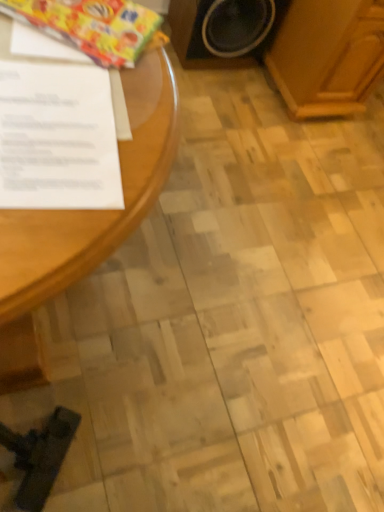
Describe the element at coordinates (91, 26) in the screenshot. This screenshot has height=512, width=384. I see `shiny plastic wrapping paper at upper left` at that location.

Measure the distance between wooden speaker at upper right and camera.

The depth of wooden speaker at upper right is 1.81 meters.

Find the location of a particular element. This screenshot has height=512, width=384. light brown wood at upper right is located at coordinates (328, 56).

In order to face white paper at left, should I rotate leftwards or rightwards?

Rotate your view left by about 21.031°.

The image size is (384, 512). What are the coordinates of `shiny plastic wrapping paper at upper left` in the screenshot? It's located at (91, 26).

Which is more to the right, shiny plastic wrapping paper at upper left or white paper at left?

From the viewer's perspective, shiny plastic wrapping paper at upper left appears more on the right side.

Does point (116, 61) come farther from viewer compared to point (61, 188)?

Yes, point (116, 61) is behind point (61, 188).

Is shiny plastic wrapping paper at upper left in front of or behind white paper at left in the image?

shiny plastic wrapping paper at upper left is behind white paper at left.

From a real-world perspective, which is physically above, shiny plastic wrapping paper at upper left or white paper at left?

white paper at left is physically above.

Identify the location of document on the left of the light brown wood at upper right. This screenshot has height=512, width=384. (57, 138).

Is light brown wood at upper right to the left of white paper at left from the viewer's perspective?

No.

Could you tell me if light brown wood at upper right is turned towards white paper at left?

No, light brown wood at upper right is not oriented towards white paper at left.

How different are the orientations of light brown wood at upper right and white paper at left in degrees?

The angular difference between light brown wood at upper right and white paper at left is 88 degrees.

Is shiny plastic wrapping paper at upper left taller than light brown wood at upper right?

Incorrect, the height of shiny plastic wrapping paper at upper left is not larger of that of light brown wood at upper right.

From the image's perspective, is shiny plastic wrapping paper at upper left located beneath light brown wood at upper right?

Yes, from the image's perspective, shiny plastic wrapping paper at upper left is beneath light brown wood at upper right.

Based on the photo, is shiny plastic wrapping paper at upper left positioned in front of light brown wood at upper right?

Yes, shiny plastic wrapping paper at upper left is in front of light brown wood at upper right.

Which is more to the left, shiny plastic wrapping paper at upper left or light brown wood at upper right?

shiny plastic wrapping paper at upper left.

In the scene shown: Who is shorter, white paper at left or wooden speaker at upper right?

white paper at left is shorter.

In the scene shown: Which object is thinner, white paper at left or wooden speaker at upper right?

Thinner between the two is white paper at left.

Considering the points (105, 106) and (246, 16), which point is in front, point (105, 106) or point (246, 16)?

Point (105, 106)

In the scene shown: Is white paper at left further to the viewer compared to wooden speaker at upper right?

No, the depth of white paper at left is less than that of wooden speaker at upper right.

Based on the photo, in terms of size, does light brown wood at upper right appear bigger or smaller than wooden speaker at upper right?

Considering their sizes, light brown wood at upper right takes up more space than wooden speaker at upper right.

In the scene shown: From a real-world perspective, which is physically above, light brown wood at upper right or wooden speaker at upper right?

light brown wood at upper right.

Does point (317, 34) appear closer or farther from the camera than point (211, 19)?

Point (317, 34) is positioned closer to the camera compared to point (211, 19).

Is light brown wood at upper right further to the viewer compared to wooden speaker at upper right?

No.

Is the position of white paper at left more distant than that of shiny plastic wrapping paper at upper left?

No, it is in front of shiny plastic wrapping paper at upper left.

Is white paper at left spatially inside shiny plastic wrapping paper at upper left, or outside of it?

The correct answer is: outside.

Is point (36, 200) behind point (340, 20)?

No, (36, 200) is in front of (340, 20).

Is white paper at left far from light brown wood at upper right?

Yes.

From the image's perspective, relative to light brown wood at upper right, is white paper at left above or below?

From the image's perspective, white paper at left appears below light brown wood at upper right.

Could you tell me if white paper at left is turned towards light brown wood at upper right?

No, white paper at left is not aimed at light brown wood at upper right.

At what (x,y) coordinates should I click in order to perform the action: click on document in front of the shiny plastic wrapping paper at upper left. Please return your answer as a coordinate pair (x, y). The width and height of the screenshot is (384, 512). Looking at the image, I should click on (57, 138).

At what (x,y) coordinates should I click in order to perform the action: click on wood above the white paper at left (from the image's perspective). Please return your answer as a coordinate pair (x, y). Looking at the image, I should click on (328, 56).

Based on their spatial positions, is wooden speaker at upper right or white paper at left closer to shiny plastic wrapping paper at upper left?

white paper at left is positioned closer to the anchor shiny plastic wrapping paper at upper left.

Which object lies further to the anchor point shiny plastic wrapping paper at upper left, white paper at left or light brown wood at upper right?

Among the two, light brown wood at upper right is located further to shiny plastic wrapping paper at upper left.

Considering their positions, is white paper at left positioned closer to light brown wood at upper right than shiny plastic wrapping paper at upper left?

The object closer to light brown wood at upper right is shiny plastic wrapping paper at upper left.

Based on their spatial positions, is wooden speaker at upper right or light brown wood at upper right closer to white paper at left?

The object closer to white paper at left is wooden speaker at upper right.

Estimate the real-world distances between objects in this image. Which object is further from shiny plastic wrapping paper at upper left, white paper at left or wooden speaker at upper right?

wooden speaker at upper right is further to shiny plastic wrapping paper at upper left.

From the image, which object appears to be nearer to white paper at left, light brown wood at upper right or wooden speaker at upper right?

Based on the image, wooden speaker at upper right appears to be nearer to white paper at left.

Considering their positions, is light brown wood at upper right positioned closer to shiny plastic wrapping paper at upper left than white paper at left?

white paper at left is positioned closer to the anchor shiny plastic wrapping paper at upper left.

In the scene shown: From the image, which object appears to be farther from white paper at left, light brown wood at upper right or shiny plastic wrapping paper at upper left?

Among the two, light brown wood at upper right is located further to white paper at left.

Find the location of a particular element. wood between white paper at left and wooden speaker at upper right from front to back is located at coordinates (328, 56).

The height and width of the screenshot is (512, 384). I want to click on wrapping paper situated between white paper at left and light brown wood at upper right from left to right, so click(x=91, y=26).

Image resolution: width=384 pixels, height=512 pixels. I want to click on wrapping paper located between white paper at left and wooden speaker at upper right in the depth direction, so click(91, 26).

At what (x,y) coordinates should I click in order to perform the action: click on appliance between shiny plastic wrapping paper at upper left and light brown wood at upper right from left to right. Please return your answer as a coordinate pair (x, y). This screenshot has width=384, height=512. Looking at the image, I should click on (223, 31).